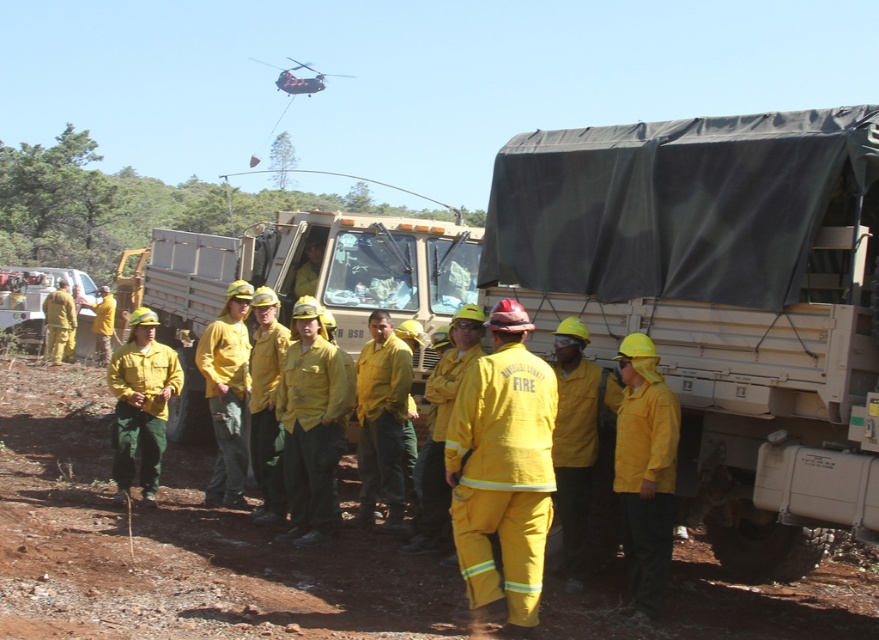
How far apart are yellow fireproof suit at center and black matte helicopter at upper center?

yellow fireproof suit at center is 52.23 meters away from black matte helicopter at upper center.

What do you see at coordinates (502, 476) in the screenshot? I see `yellow fireproof suit at center` at bounding box center [502, 476].

This screenshot has width=879, height=640. What are the coordinates of `yellow fireproof suit at center` in the screenshot? It's located at [502, 476].

Between point (224, 266) and point (296, 83), which one is positioned behind?

Positioned behind is point (296, 83).

Is matte yellow truck at center further to camera compared to black matte helicopter at upper center?

No, it is not.

Does point (201, 244) lie in front of point (282, 84)?

Yes, point (201, 244) is closer to viewer.

Identify the location of matte yellow truck at center. The width and height of the screenshot is (879, 640). (300, 280).

Which is more to the right, matte gray trailer truck at right or yellow matte fire jacket at center?

From the viewer's perspective, matte gray trailer truck at right appears more on the right side.

Is point (698, 387) more distant than point (197, 342)?

That is False.

This screenshot has width=879, height=640. Find the location of `matte gray trailer truck at right`. matte gray trailer truck at right is located at coordinates (720, 301).